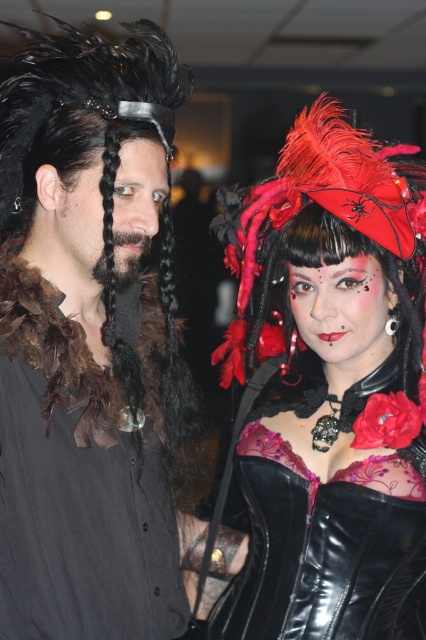
Question: Does matte black shirt at center lie behind matte black corset at center?

Choices:
 (A) no
 (B) yes

Answer: (A)

Question: Can you confirm if matte black corset at center is bigger than velvet red headdress at upper right?

Choices:
 (A) yes
 (B) no

Answer: (A)

Question: Which point is farther to the camera?

Choices:
 (A) (322, 136)
 (B) (362, 512)
 (C) (190, 385)

Answer: (C)

Question: Among these points, which one is farthest from the camera?

Choices:
 (A) (282, 208)
 (B) (9, 141)

Answer: (A)

Question: Which of the following is the closest to the observer?

Choices:
 (A) (293, 150)
 (B) (345, 138)
 (C) (235, 536)

Answer: (B)

Question: In this image, where is matte black shirt at center located relative to matte black corset at center?

Choices:
 (A) above
 (B) below

Answer: (A)